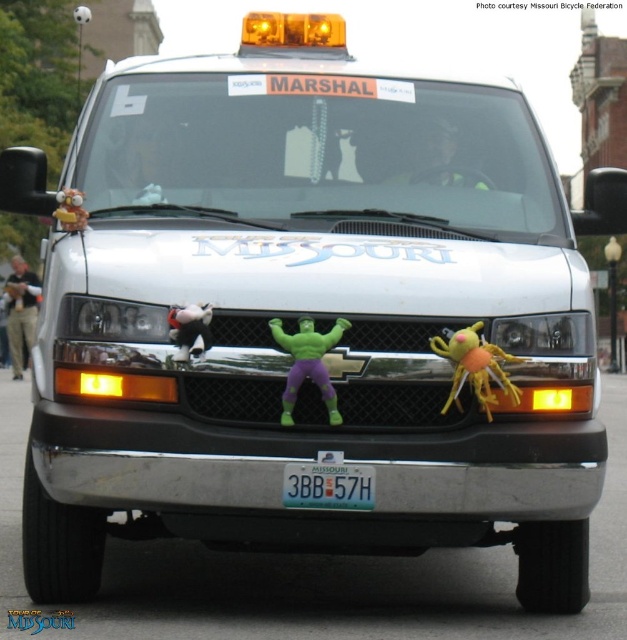
You are a photographer standing in front of the Tour de Missouri van. You want to take a photo that includes both the white plush duck at center and the plush yellow monkey at left. Which of the two toys should you focus on to ensure they both fit in the frame?

The white plush duck at center occupies less space than the plush yellow monkey at left, so focusing on the plush yellow monkey at left would ensure both fit in the frame since it takes up more space and can help frame the shot appropriately.

You are a photographer standing in front of the Tour de Missouri van. You want to take a photo that captures both the white plush duck at center and the plush yellow monkey at left. Which toy is positioned lower on the van?

The white plush duck at center is positioned lower than the plush yellow monkey at left, as it is located below it.

You are a participant in the Tour de Missouri event and need to attach a new toy to your van. The event rules state that any new toy must be placed exactly at the same coordinates as the green rubber toy at center. What are the coordinates where you should place your new toy?

The green rubber toy at center is located at point (307, 364), so you should place your new toy at those exact coordinates.